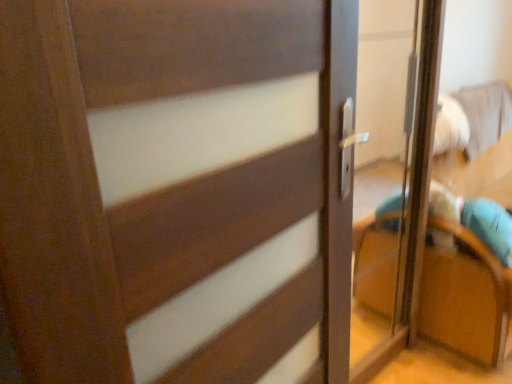
Describe the element at coordinates (173, 189) in the screenshot. This screenshot has height=384, width=512. I see `matte wood door at center` at that location.

At what (x,y) coordinates should I click in order to perform the action: click on matte wood door at center. Please return your answer as a coordinate pair (x, y). This screenshot has height=384, width=512. Looking at the image, I should click on (173, 189).

This screenshot has width=512, height=384. I want to click on teal fabric armchair at right, so click(x=465, y=299).

Image resolution: width=512 pixels, height=384 pixels. What do you see at coordinates (465, 299) in the screenshot?
I see `teal fabric armchair at right` at bounding box center [465, 299].

I want to click on matte wood door at center, so click(173, 189).

Based on their positions, is teal fabric armchair at right located to the left or right of matte wood door at center?

Clearly, teal fabric armchair at right is on the right of matte wood door at center in the image.

Who is more distant, teal fabric armchair at right or matte wood door at center?

teal fabric armchair at right is further from the camera.

Between point (501, 323) and point (184, 17), which one is positioned behind?

The point (501, 323) is behind.

From the image's perspective, would you say teal fabric armchair at right is shown under matte wood door at center?

No, from the image's perspective, teal fabric armchair at right is not below matte wood door at center.

From a real-world perspective, is teal fabric armchair at right on matte wood door at center?

No, from a real-world perspective, teal fabric armchair at right is not over matte wood door at center

Between teal fabric armchair at right and matte wood door at center, which one has smaller width?

matte wood door at center.

Between teal fabric armchair at right and matte wood door at center, which one has less height?

Standing shorter between the two is teal fabric armchair at right.

Is teal fabric armchair at right smaller than matte wood door at center?

Incorrect, teal fabric armchair at right is not smaller in size than matte wood door at center.

Is teal fabric armchair at right not inside matte wood door at center?

teal fabric armchair at right lies outside matte wood door at center's area.

Is teal fabric armchair at right far away from matte wood door at center?

Indeed, teal fabric armchair at right is not near matte wood door at center.

Does teal fabric armchair at right turn towards matte wood door at center?

No, teal fabric armchair at right is not turned towards matte wood door at center.

How many degrees apart are the facing directions of teal fabric armchair at right and matte wood door at center?

The angular difference between teal fabric armchair at right and matte wood door at center is 1.55 degrees.

How distant is teal fabric armchair at right from matte wood door at center?

teal fabric armchair at right and matte wood door at center are 1.06 meters apart from each other.

I want to click on armchair on the right of matte wood door at center, so click(x=465, y=299).

Between matte wood door at center and teal fabric armchair at right, which one appears on the right side from the viewer's perspective?

teal fabric armchair at right is more to the right.

Is matte wood door at center further to camera compared to teal fabric armchair at right?

That is False.

Which is farther from the camera, (42,279) or (370,305)?

Positioned behind is point (370,305).

Based on the photo, from the image's perspective, which is below, matte wood door at center or teal fabric armchair at right?

matte wood door at center.

From a real-world perspective, does matte wood door at center sit lower than teal fabric armchair at right?

Actually, matte wood door at center is physically above teal fabric armchair at right in the real world.

Is matte wood door at center wider or thinner than teal fabric armchair at right?

Clearly, matte wood door at center has less width compared to teal fabric armchair at right.

Who is taller, matte wood door at center or teal fabric armchair at right?

With more height is matte wood door at center.

Considering the sizes of matte wood door at center and teal fabric armchair at right in the image, is matte wood door at center bigger or smaller than teal fabric armchair at right?

Considering their sizes, matte wood door at center takes up less space than teal fabric armchair at right.

Is matte wood door at center located outside teal fabric armchair at right?

Yes, matte wood door at center is not within teal fabric armchair at right.

Looking at this image, is matte wood door at center positioned far away from teal fabric armchair at right?

Yes, matte wood door at center is far from teal fabric armchair at right.

Is matte wood door at center oriented towards teal fabric armchair at right?

No, matte wood door at center does not turn towards teal fabric armchair at right.

You are a GUI agent. You are given a task and a screenshot of the screen. Output one action in this format:
    pyautogui.click(x=<x>, y=<y>)
    Task: Click on the door above the teal fabric armchair at right (from a real-world perspective)
    This screenshot has height=384, width=512.
    Given the screenshot: What is the action you would take?
    pyautogui.click(x=173, y=189)

The width and height of the screenshot is (512, 384). I want to click on door above the teal fabric armchair at right (from a real-world perspective), so click(x=173, y=189).

Identify the location of armchair below the matte wood door at center (from a real-world perspective). (465, 299).